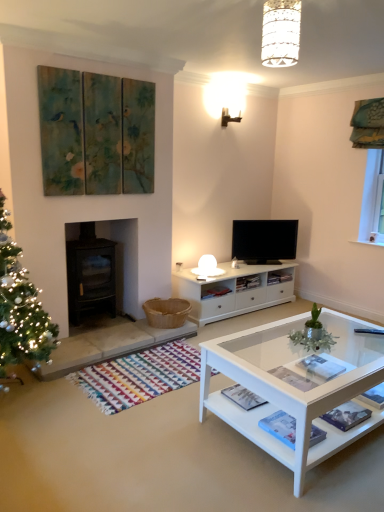
Question: In terms of size, does white glass coffee table at lower right appear bigger or smaller than black glass fireplace at left?

Choices:
 (A) big
 (B) small

Answer: (A)

Question: Is white glass coffee table at lower right situated inside black glass fireplace at left or outside?

Choices:
 (A) outside
 (B) inside

Answer: (A)

Question: Based on their relative distances, which object is nearer to the white textured lampshade at upper center?

Choices:
 (A) white glass coffee table at lower right
 (B) flat screen tv at center
 (C) black glass fireplace at left

Answer: (A)

Question: Which object is the closest to the white glass coffee table at lower right?

Choices:
 (A) flat screen tv at center
 (B) white textured lampshade at upper center
 (C) black glass fireplace at left

Answer: (C)